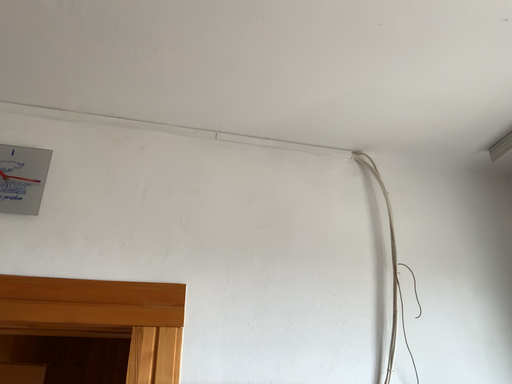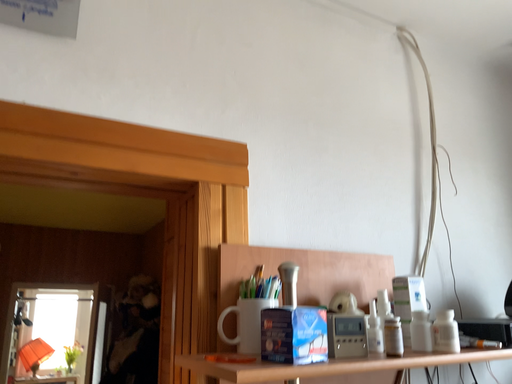
Question: How did the camera likely rotate when shooting the video?

Choices:
 (A) rotated downward
 (B) rotated upward

Answer: (A)